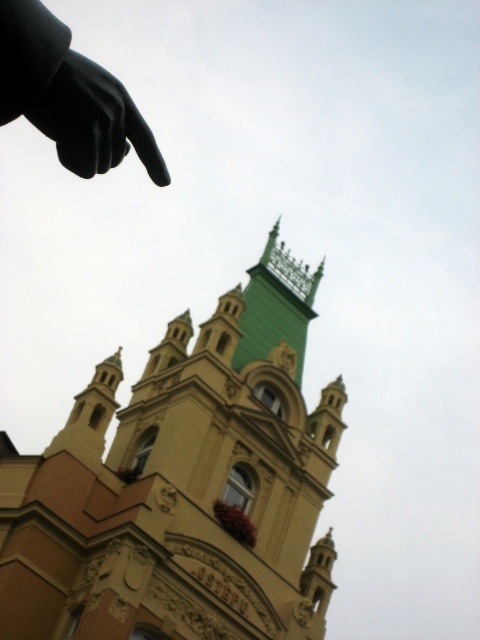
Does beige stone church at center come in front of black matte hand at upper left?

No, it is not.

Which is above, beige stone church at center or black matte hand at upper left?

black matte hand at upper left is above.

Is point (168, 360) closer to camera compared to point (94, 147)?

That is False.

Locate an element on the screen. The image size is (480, 640). beige stone church at center is located at coordinates (183, 484).